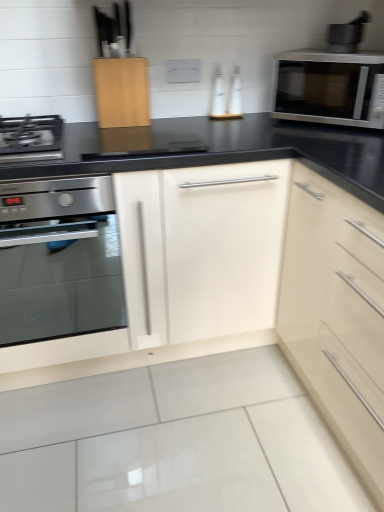
Question: Does satin stainless steel oven at left have a smaller size compared to satin silver microwave at upper right?

Choices:
 (A) no
 (B) yes

Answer: (A)

Question: Is satin stainless steel oven at left facing towards satin silver microwave at upper right?

Choices:
 (A) no
 (B) yes

Answer: (A)

Question: From a real-world perspective, is satin stainless steel oven at left below satin silver microwave at upper right?

Choices:
 (A) no
 (B) yes

Answer: (B)

Question: Does satin stainless steel oven at left have a greater height compared to satin silver microwave at upper right?

Choices:
 (A) no
 (B) yes

Answer: (B)

Question: Considering the relative positions of satin stainless steel oven at left and satin silver microwave at upper right in the image provided, is satin stainless steel oven at left to the left of satin silver microwave at upper right from the viewer's perspective?

Choices:
 (A) yes
 (B) no

Answer: (A)

Question: From the image's perspective, is satin stainless steel oven at left located above or below metallic gray mortar and pestle at upper right?

Choices:
 (A) below
 (B) above

Answer: (A)

Question: Is satin stainless steel oven at left inside or outside of metallic gray mortar and pestle at upper right?

Choices:
 (A) outside
 (B) inside

Answer: (A)

Question: Considering the relative positions of satin stainless steel oven at left and metallic gray mortar and pestle at upper right in the image provided, is satin stainless steel oven at left to the left or to the right of metallic gray mortar and pestle at upper right?

Choices:
 (A) right
 (B) left

Answer: (B)

Question: From a real-world perspective, relative to metallic gray mortar and pestle at upper right, is satin stainless steel oven at left vertically above or below?

Choices:
 (A) above
 (B) below

Answer: (B)

Question: From the image's perspective, is metallic gray mortar and pestle at upper right located above or below satin stainless steel oven at left?

Choices:
 (A) above
 (B) below

Answer: (A)

Question: In the image, is metallic gray mortar and pestle at upper right positioned in front of or behind satin stainless steel oven at left?

Choices:
 (A) front
 (B) behind

Answer: (B)

Question: Would you say metallic gray mortar and pestle at upper right is inside or outside satin stainless steel oven at left?

Choices:
 (A) inside
 (B) outside

Answer: (B)

Question: Is point (357, 26) positioned closer to the camera than point (48, 287)?

Choices:
 (A) closer
 (B) farther

Answer: (A)

Question: Do you think satin silver microwave at upper right is within metallic gray mortar and pestle at upper right, or outside of it?

Choices:
 (A) inside
 (B) outside

Answer: (B)

Question: Considering their positions, is satin silver microwave at upper right located in front of or behind metallic gray mortar and pestle at upper right?

Choices:
 (A) front
 (B) behind

Answer: (A)